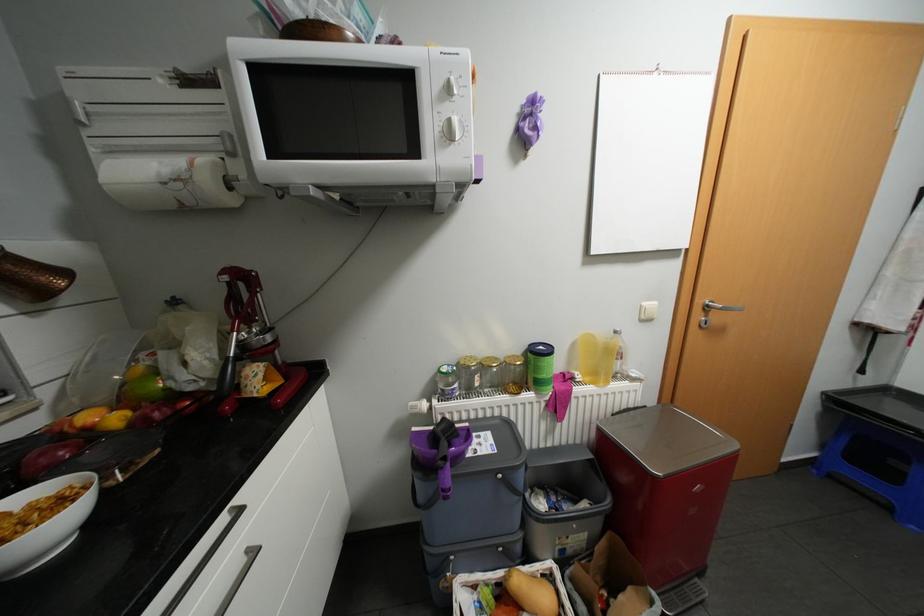
Describe the element at coordinates (683, 596) in the screenshot. This screenshot has width=924, height=616. I see `a trash can pedal` at that location.